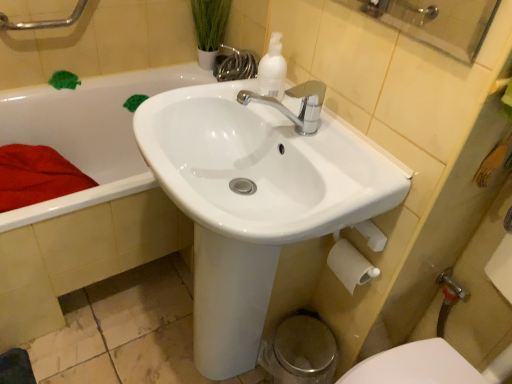
The image size is (512, 384). In order to click on free location to the right of polished chrome faucet at center in this screenshot , I will do `click(351, 157)`.